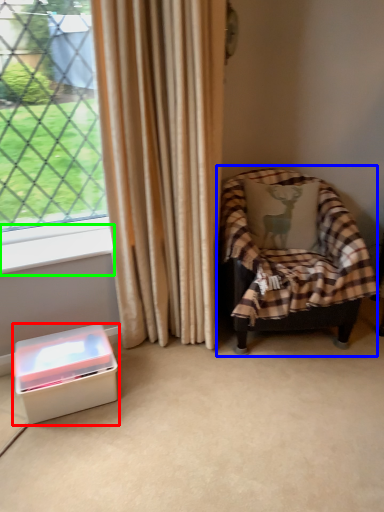
Question: Which is nearer to the box (highlighted by a red box)? chair (highlighted by a blue box) or window sill (highlighted by a green box).

Choices:
 (A) chair
 (B) window sill

Answer: (B)